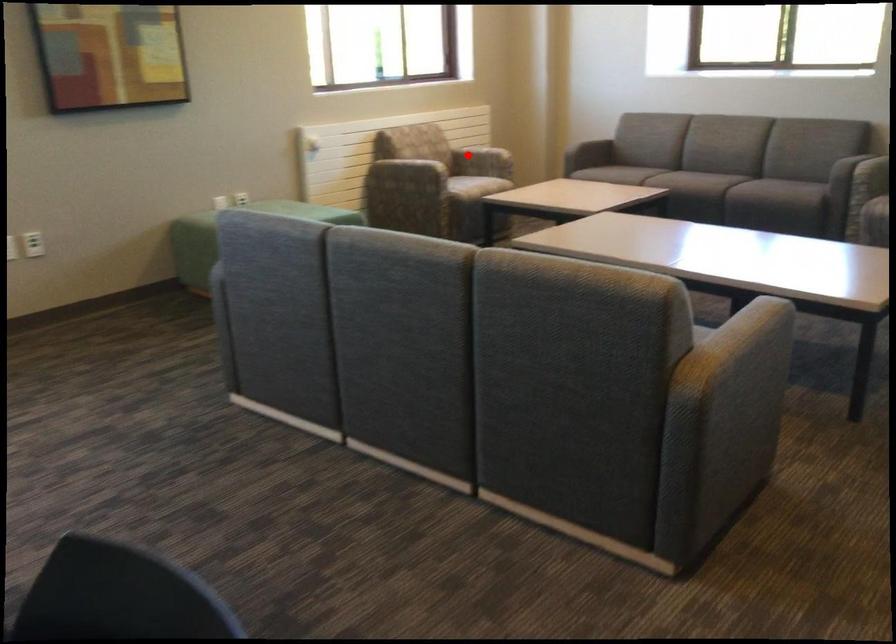
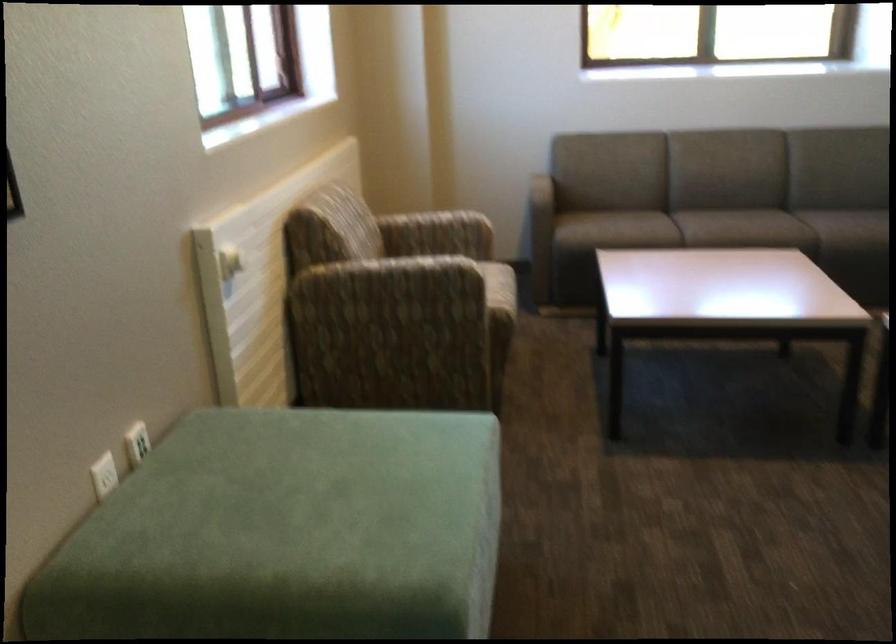
The point at the highlighted location is marked in the first image. Where is the corresponding point in the second image?

(436, 234)